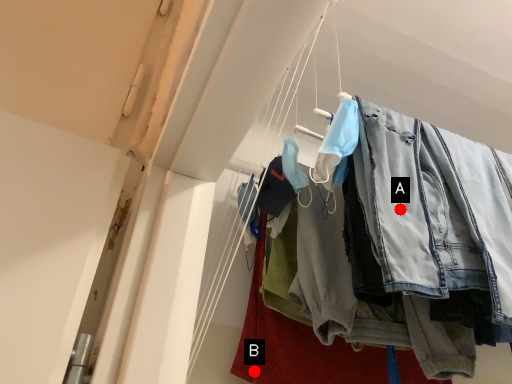
Question: Two points are circled on the image, labeled by A and B beside each circle. Which of the following is the closest to the observer?

Choices:
 (A) A is closer
 (B) B is closer

Answer: (A)